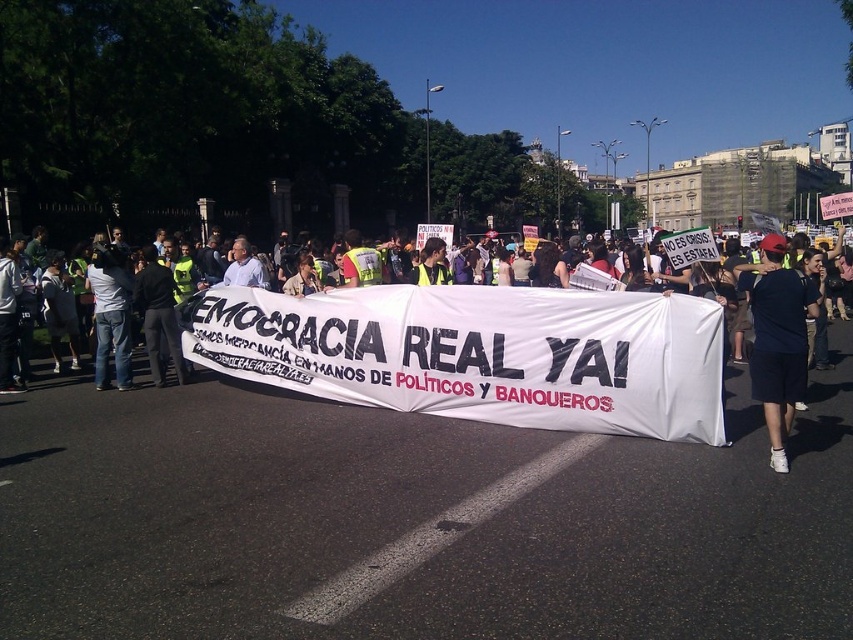
Question: Does black fabric banner at center have a larger size compared to black cotton t-shirt at center?

Choices:
 (A) yes
 (B) no

Answer: (B)

Question: Is black fabric banner at center bigger than black cotton t-shirt at center?

Choices:
 (A) yes
 (B) no

Answer: (B)

Question: Can you confirm if black fabric banner at center is bigger than black cotton t-shirt at center?

Choices:
 (A) no
 (B) yes

Answer: (A)

Question: Among these objects, which one is farthest from the camera?

Choices:
 (A) black cotton t-shirt at center
 (B) black fabric banner at center

Answer: (B)

Question: Which point is closer to the camera?

Choices:
 (A) (746, 288)
 (B) (664, 408)

Answer: (B)